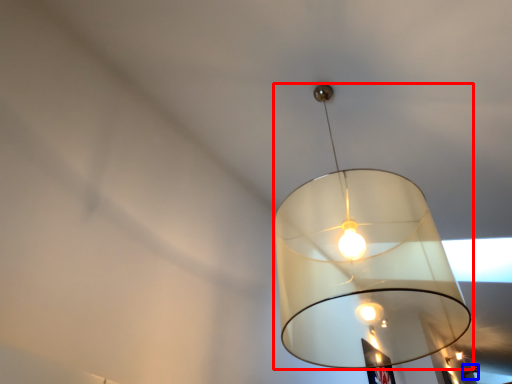
Question: Which object is further to the camera taking this photo, lamp (highlighted by a red box) or lamp (highlighted by a blue box)?

Choices:
 (A) lamp
 (B) lamp

Answer: (B)